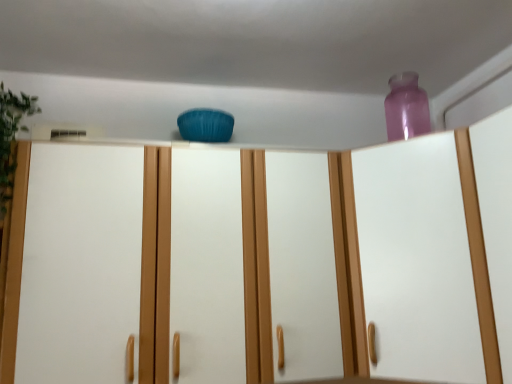
Question: In terms of height, does transparent purple bottle at upper right look taller or shorter compared to matte blue cushion at center?

Choices:
 (A) short
 (B) tall

Answer: (A)

Question: In terms of size, does transparent purple bottle at upper right appear bigger or smaller than matte blue cushion at center?

Choices:
 (A) big
 (B) small

Answer: (B)

Question: Estimate the real-world distances between objects in this image. Which object is farther from the transparent purple bottle at upper right?

Choices:
 (A) green leafy plant at left
 (B) matte blue cushion at center
 (C) transparent plastic vase at upper right

Answer: (A)

Question: Estimate the real-world distances between objects in this image. Which object is closer to the transparent plastic vase at upper right?

Choices:
 (A) matte blue cushion at center
 (B) transparent purple bottle at upper right
 (C) green leafy plant at left

Answer: (A)